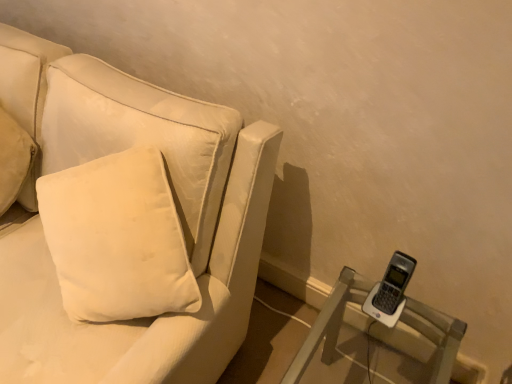
Question: From the image's perspective, is velvet white couch at left above clear plastic phone at lower right?

Choices:
 (A) no
 (B) yes

Answer: (B)

Question: Is velvet white couch at left at the right side of clear plastic phone at lower right?

Choices:
 (A) no
 (B) yes

Answer: (A)

Question: Is velvet white couch at left outside clear plastic phone at lower right?

Choices:
 (A) no
 (B) yes

Answer: (B)

Question: Is velvet white couch at left facing away from clear plastic phone at lower right?

Choices:
 (A) yes
 (B) no

Answer: (B)

Question: Can clear plastic phone at lower right be found inside velvet white couch at left?

Choices:
 (A) no
 (B) yes

Answer: (A)

Question: Does velvet white couch at left appear on the left side of clear plastic phone at lower right?

Choices:
 (A) no
 (B) yes

Answer: (B)

Question: Are clear plastic phone at lower right and velvet white couch at left located far from each other?

Choices:
 (A) yes
 (B) no

Answer: (B)

Question: Can you confirm if clear plastic phone at lower right is positioned to the right of velvet white couch at left?

Choices:
 (A) no
 (B) yes

Answer: (B)

Question: Is clear plastic phone at lower right not within velvet white couch at left?

Choices:
 (A) yes
 (B) no

Answer: (A)

Question: Is clear plastic phone at lower right behind velvet white couch at left?

Choices:
 (A) yes
 (B) no

Answer: (A)

Question: From a real-world perspective, is clear plastic phone at lower right located higher than velvet white couch at left?

Choices:
 (A) yes
 (B) no

Answer: (B)

Question: Does clear plastic phone at lower right have a lesser width compared to velvet white couch at left?

Choices:
 (A) no
 (B) yes

Answer: (B)

Question: Considering the relative sizes of velvet white couch at left and white soft cushion at left in the image provided, is velvet white couch at left smaller than white soft cushion at left?

Choices:
 (A) yes
 (B) no

Answer: (B)